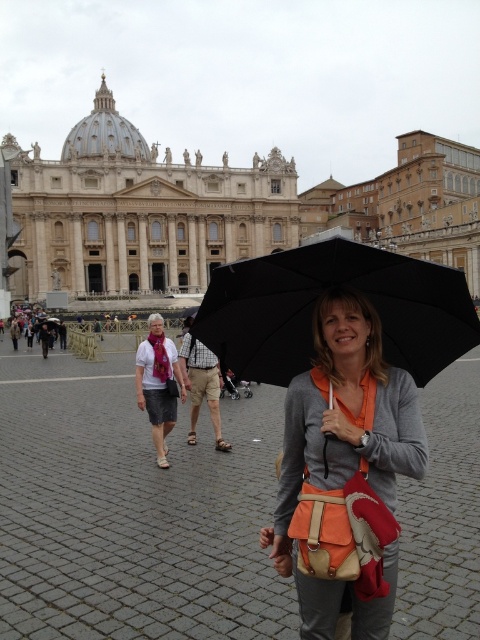
Question: Which point is farther to the camera?

Choices:
 (A) orange fabric umbrella at center
 (B) matte orange bag at center
 (C) black matte umbrella at center

Answer: (C)

Question: Is matte orange bag at center to the right of black matte umbrella at center from the viewer's perspective?

Choices:
 (A) no
 (B) yes

Answer: (B)

Question: From the image, what is the correct spatial relationship of orange fabric umbrella at center in relation to white marble palace at upper center?

Choices:
 (A) below
 (B) above

Answer: (A)

Question: Which point is farther to the camera?

Choices:
 (A) matte orange bag at center
 (B) black matte umbrella at center
 (C) white marble palace at upper center

Answer: (C)

Question: Considering the relative positions of white marble palace at upper center and matte orange bag at center in the image provided, where is white marble palace at upper center located with respect to matte orange bag at center?

Choices:
 (A) left
 (B) right

Answer: (A)

Question: Which of the following is the farthest from the observer?

Choices:
 (A) black matte umbrella at center
 (B) white marble palace at upper center

Answer: (B)